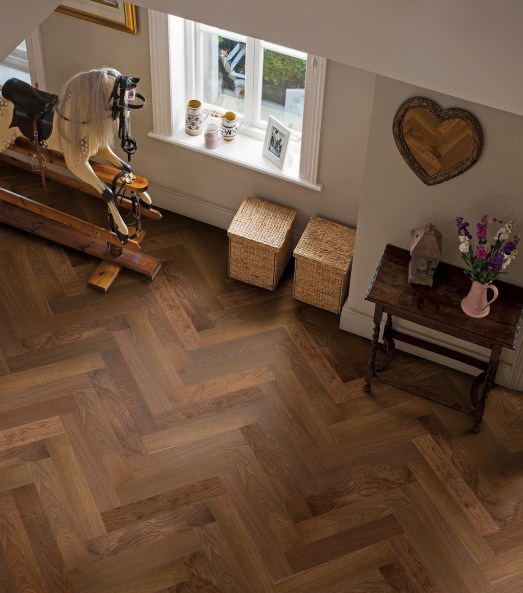
Find the location of a particular element. parque flooring is located at coordinates (247, 557).